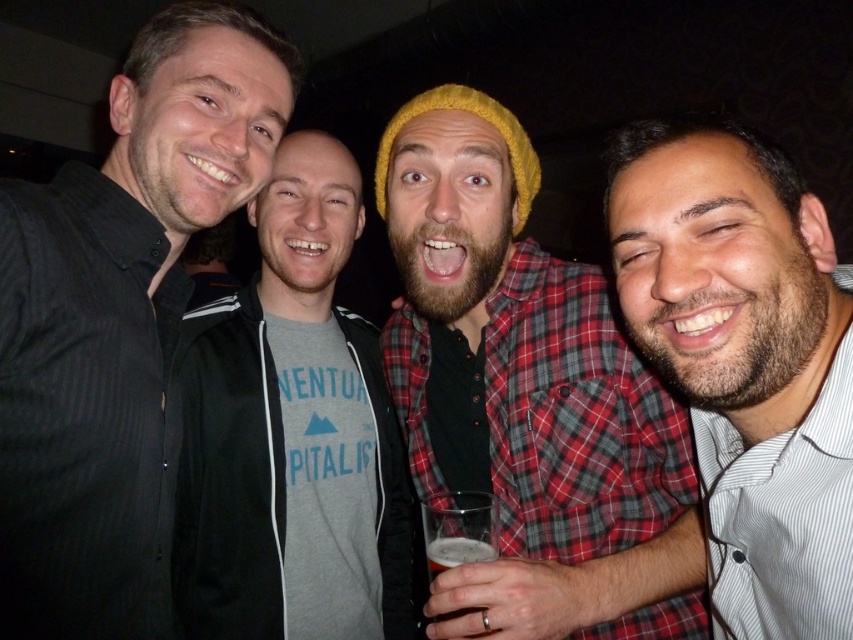
Is yellow knitted hat at center closer to camera compared to translucent glass beer at center?

No, yellow knitted hat at center is behind translucent glass beer at center.

Measure the distance between yellow knitted hat at center and camera.

The distance of yellow knitted hat at center from camera is 1.02 meters.

This screenshot has width=853, height=640. What do you see at coordinates (479, 116) in the screenshot?
I see `yellow knitted hat at center` at bounding box center [479, 116].

Locate an element on the screen. yellow knitted hat at center is located at coordinates (479, 116).

Can you confirm if knitted yellow beanie at center is wider than white striped shirt at right?

Yes, knitted yellow beanie at center is wider than white striped shirt at right.

Is knitted yellow beanie at center closer to camera compared to white striped shirt at right?

That is False.

At what (x,y) coordinates should I click in order to perform the action: click on knitted yellow beanie at center. Please return your answer as a coordinate pair (x, y). Looking at the image, I should click on (527, 394).

What are the coordinates of `knitted yellow beanie at center` in the screenshot? It's located at click(x=527, y=394).

Is gray zip-up hoodie at center to the left of yellow knitted hat at center from the viewer's perspective?

Yes, gray zip-up hoodie at center is to the left of yellow knitted hat at center.

Is point (387, 516) less distant than point (521, 180)?

That is False.

You are a GUI agent. You are given a task and a screenshot of the screen. Output one action in this format:
    pyautogui.click(x=<x>, y=<y>)
    Task: Click on the gray zip-up hoodie at center
    This screenshot has height=640, width=853.
    Given the screenshot: What is the action you would take?
    pyautogui.click(x=292, y=435)